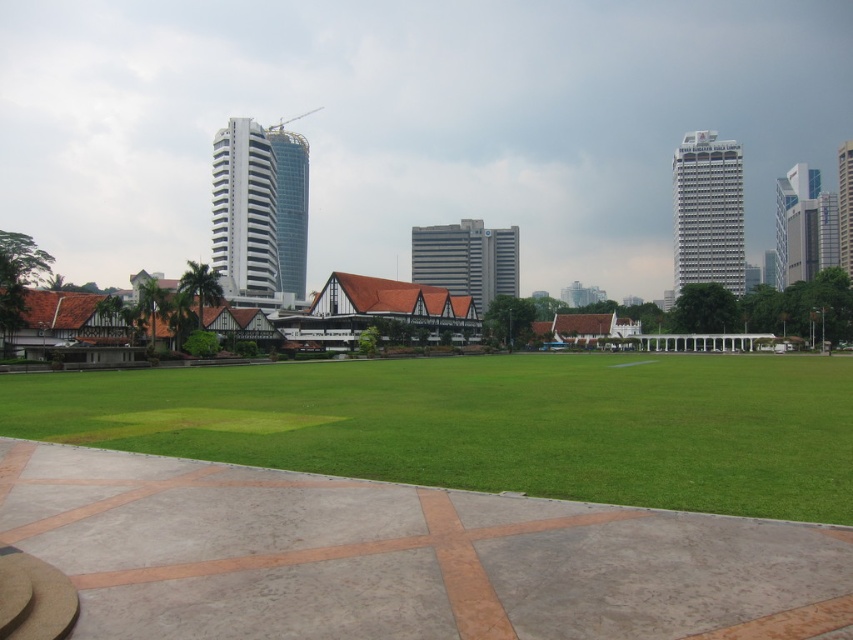
You are an architect evaluating the urban layout. Considering the white glossy building at upper left and the glassy blue tower at center, which one has a greater overall size?

The white glossy building at upper left is larger in size than the glassy blue tower at center.

You are a city planner analyzing the urban layout. Based on the scene, which object is positioned to the left of the other between the gray concrete building at center and the white glass skyscraper at right?

The gray concrete building at center is positioned to the left of the white glass skyscraper at right.

You are standing at the point with coordinates point (850, 243) and want to walk to the point with coordinates point (672, 243). Is there a clear path between these two points?

Yes, there is a clear path between point (850, 243) and point (672, 243) because point (672, 243) is behind point (850, 243), so there are no obstacles blocking the way.